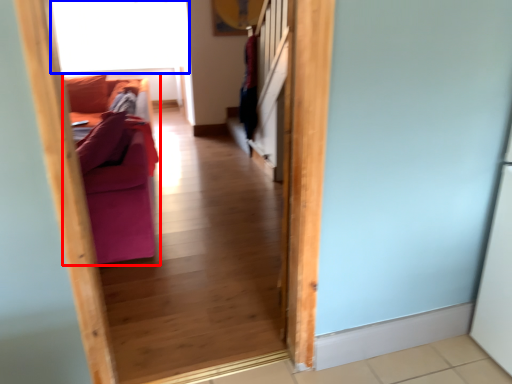
Question: Which object is further to the camera taking this photo, furniture (highlighted by a red box) or window screen (highlighted by a blue box)?

Choices:
 (A) furniture
 (B) window screen

Answer: (B)